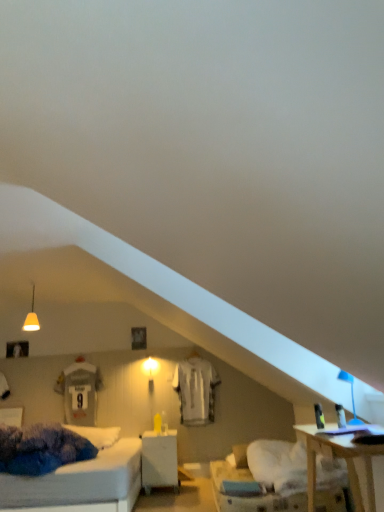
What is the approximate height of blue plastic table lamp at upper right?

38.10 centimeters.

Describe the element at coordinates (196, 390) in the screenshot. I see `white jersey at center` at that location.

Locate an element on the screen. matte white pendant light at upper left is located at coordinates (31, 316).

What are the coordinates of `white fabric pillow at lower center` in the screenshot? It's located at (240, 455).

The height and width of the screenshot is (512, 384). I want to click on white glossy nightstand at center, so click(159, 460).

Identify the location of sheet that appears below the matte white pendant light at upper left (from the image's perspective). (196, 390).

Is white jersey at center turned away from matte white pendant light at upper left?

No, white jersey at center is not facing away from matte white pendant light at upper left.

Based on the photo, is white jersey at center in front of matte white pendant light at upper left?

That is False.

Looking at the image, does blue plastic table lamp at upper right seem bigger or smaller compared to white jersey at center?

blue plastic table lamp at upper right is smaller than white jersey at center.

What's the angular difference between blue plastic table lamp at upper right and white jersey at center's facing directions?

blue plastic table lamp at upper right and white jersey at center are facing 91.1 degrees away from each other.

From the image's perspective, between blue plastic table lamp at upper right and white jersey at center, who is located below?

From the image's view, white jersey at center is below.

Is blue plastic table lamp at upper right oriented towards white jersey at center?

No.

Looking at this image, is there a large distance between matte white pendant light at upper left and white jersey at center?

Yes, matte white pendant light at upper left is far from white jersey at center.

Considering the relative positions of matte white pendant light at upper left and white jersey at center in the image provided, is matte white pendant light at upper left to the right of white jersey at center from the viewer's perspective?

No.

From the image's perspective, is matte white pendant light at upper left located above or below white jersey at center?

From the image's perspective, matte white pendant light at upper left appears above white jersey at center.

Is point (34, 314) closer or farther from the camera than point (177, 377)?

Clearly, point (34, 314) is closer to the camera than point (177, 377).

From the image's perspective, is white jersey at center under blue plastic table lamp at upper right?

Yes.

How far apart are white jersey at center and blue plastic table lamp at upper right?

white jersey at center is 3.14 meters away from blue plastic table lamp at upper right.

Can you confirm if white jersey at center is positioned to the left of blue plastic table lamp at upper right?

Yes.

Is the position of white jersey at center less distant than that of blue plastic table lamp at upper right?

No, white jersey at center is further to the viewer.

Is matte white pendant light at upper left turned away from blue plastic table lamp at upper right?

No, matte white pendant light at upper left is not facing the opposite direction of blue plastic table lamp at upper right.

Between matte white pendant light at upper left and blue plastic table lamp at upper right, which one has more height?

matte white pendant light at upper left is taller.

Is matte white pendant light at upper left bigger than blue plastic table lamp at upper right?

Yes, matte white pendant light at upper left is bigger than blue plastic table lamp at upper right.

Which is further, (37, 326) or (360, 422)?

Point (37, 326)

Considering the points (144, 468) and (26, 325), which point is behind, point (144, 468) or point (26, 325)?

The point (26, 325) is farther from the camera.

Is matte white pendant light at upper left at the back of white glossy nightstand at center?

No, white glossy nightstand at center is not facing away from matte white pendant light at upper left.

From a real-world perspective, is white glossy nightstand at center beneath matte white pendant light at upper left?

Correct, in the physical world, white glossy nightstand at center is lower than matte white pendant light at upper left.

From a real-world perspective, is white fabric pillow at lower center positioned under white jersey at center based on gravity?

Yes, from a real-world perspective, white fabric pillow at lower center is below white jersey at center.

Is white fabric pillow at lower center surrounding white jersey at center?

No, white jersey at center is not surrounded by white fabric pillow at lower center.

Relative to white jersey at center, is white fabric pillow at lower center in front or behind?

white fabric pillow at lower center is positioned closer to the viewer than white jersey at center.

Would you consider white fabric pillow at lower center to be distant from white jersey at center?

white fabric pillow at lower center is positioned a significant distance from white jersey at center.

Locate an element on the screen. This screenshot has width=384, height=512. sheet below the matte white pendant light at upper left (from the image's perspective) is located at coordinates (196, 390).

You are a GUI agent. You are given a task and a screenshot of the screen. Output one action in this format:
    pyautogui.click(x=<x>, y=<y>)
    Task: Click on the sheet above the blue plastic table lamp at upper right (from a real-world perspective)
    
    Given the screenshot: What is the action you would take?
    pyautogui.click(x=196, y=390)

Looking at the image, which one is located closer to matte white pendant light at upper left, white glossy nightstand at center or white jersey at center?

Based on the image, white glossy nightstand at center appears to be nearer to matte white pendant light at upper left.

Estimate the real-world distances between objects in this image. Which object is closer to white glossy nightstand at center, white fabric pillow at lower center or white jersey at center?

white fabric pillow at lower center.

When comparing their distances from white glossy nightstand at center, does blue plastic table lamp at upper right or white jersey at center seem further?

blue plastic table lamp at upper right is positioned further to the anchor white glossy nightstand at center.

Considering their positions, is white jersey at center positioned further to blue plastic table lamp at upper right than white fabric pillow at lower center?

white jersey at center lies further to blue plastic table lamp at upper right than the other object.

When comparing their distances from white jersey at center, does white glossy nightstand at center or white fabric pillow at lower center seem closer?

white fabric pillow at lower center is closer to white jersey at center.

Which object lies further to the anchor point blue plastic table lamp at upper right, white jersey at center or white glossy nightstand at center?

The object further to blue plastic table lamp at upper right is white jersey at center.

When comparing their distances from matte white pendant light at upper left, does white fabric pillow at lower center or white jersey at center seem further?

Based on the image, white fabric pillow at lower center appears to be further to matte white pendant light at upper left.

Which object lies nearer to the anchor point blue plastic table lamp at upper right, white glossy nightstand at center or white fabric pillow at lower center?

white fabric pillow at lower center is closer to blue plastic table lamp at upper right.

Locate an element on the screen. The width and height of the screenshot is (384, 512). nightstand between matte white pendant light at upper left and white jersey at center is located at coordinates (159, 460).

You are a GUI agent. You are given a task and a screenshot of the screen. Output one action in this format:
    pyautogui.click(x=<x>, y=<y>)
    Task: Click on the pillow located between blue plastic table lamp at upper right and white jersey at center in the depth direction
    Image resolution: width=384 pixels, height=512 pixels.
    Given the screenshot: What is the action you would take?
    pyautogui.click(x=240, y=455)

You are a GUI agent. You are given a task and a screenshot of the screen. Output one action in this format:
    pyautogui.click(x=<x>, y=<y>)
    Task: Click on the sheet between matte white pendant light at upper left and white fabric pillow at lower center in the horizontal direction
    The image size is (384, 512).
    Given the screenshot: What is the action you would take?
    pyautogui.click(x=196, y=390)

At what (x,y) coordinates should I click in order to perform the action: click on nightstand located between matte white pendant light at upper left and blue plastic table lamp at upper right in the left-right direction. Please return your answer as a coordinate pair (x, y). This screenshot has height=512, width=384. Looking at the image, I should click on (159, 460).